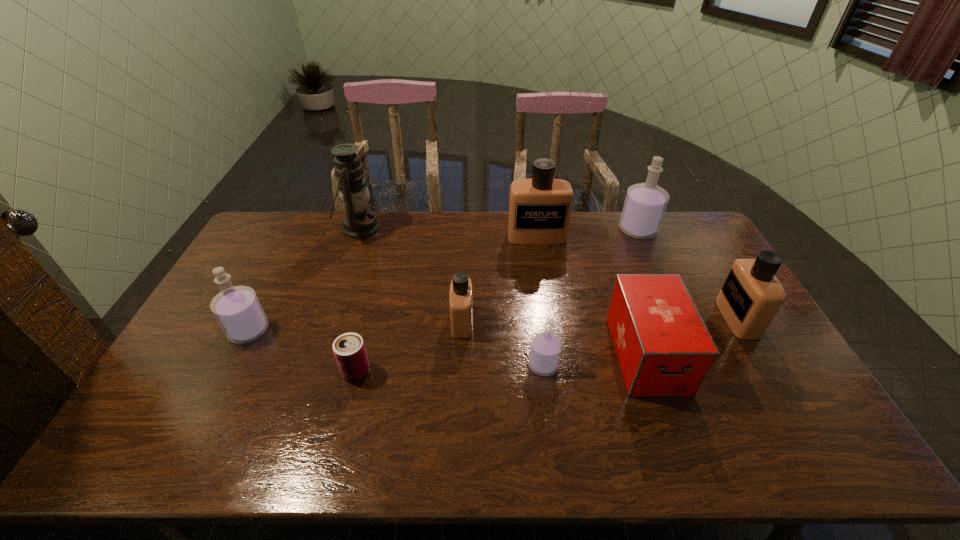
The width and height of the screenshot is (960, 540). Find the location of `purple perfume that is the second closest to the biggest purple perfume`. purple perfume that is the second closest to the biggest purple perfume is located at coordinates (237, 309).

Image resolution: width=960 pixels, height=540 pixels. Identify the location of purple perfume object that ranks as the closest to the rightmost beige perfume. (645, 204).

Where is `free space that satisfies the following two spatial constraints: 1. on the front side of the biggest purple perfume; 2. on the front label of the leftmost beige perfume`? free space that satisfies the following two spatial constraints: 1. on the front side of the biggest purple perfume; 2. on the front label of the leftmost beige perfume is located at coordinates (680, 322).

Locate an element on the screen. vacant space that satisfies the following two spatial constraints: 1. on the front label of the sixth object from right to left; 2. on the back side of the nearest perfume is located at coordinates (461, 365).